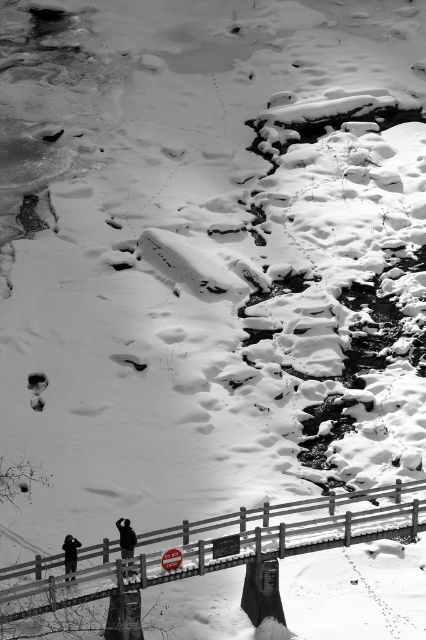
Is point (118, 524) farther from camera compared to point (74, 556)?

Yes, point (118, 524) is farther from viewer.

Does point (134, 547) lie behind point (68, 550)?

That is True.

Identify the location of black matte jacket at center. This screenshot has height=640, width=426. (126, 538).

Does concrete bridge at center appear on the right side of black matte jacket at center?

Yes, concrete bridge at center is to the right of black matte jacket at center.

You are a GUI agent. You are given a task and a screenshot of the screen. Output one action in this format:
    pyautogui.click(x=<x>, y=<y>)
    Task: Click on the concrete bridge at center
    
    Given the screenshot: What is the action you would take?
    pyautogui.click(x=219, y=545)

Is concrete bridge at center below black matte person at lower left?

Actually, concrete bridge at center is above black matte person at lower left.

Where is `concrete bridge at center`? concrete bridge at center is located at coordinates (219, 545).

At what (x,y) coordinates should I click in order to perform the action: click on concrete bridge at center. Please return your answer as a coordinate pair (x, y). The height and width of the screenshot is (640, 426). Looking at the image, I should click on (219, 545).